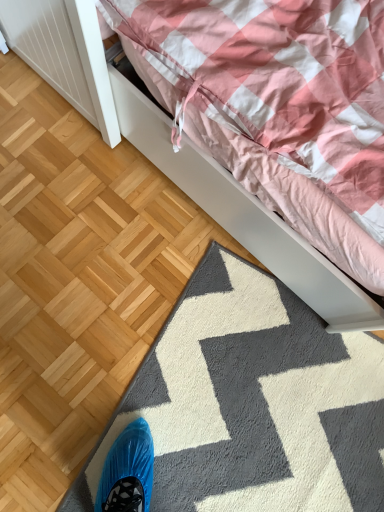
I want to click on pink cotton bed at upper right, so click(x=274, y=131).

What do you see at coordinates (274, 131) in the screenshot? I see `pink cotton bed at upper right` at bounding box center [274, 131].

Where is `pink cotton bed at upper right`? pink cotton bed at upper right is located at coordinates (274, 131).